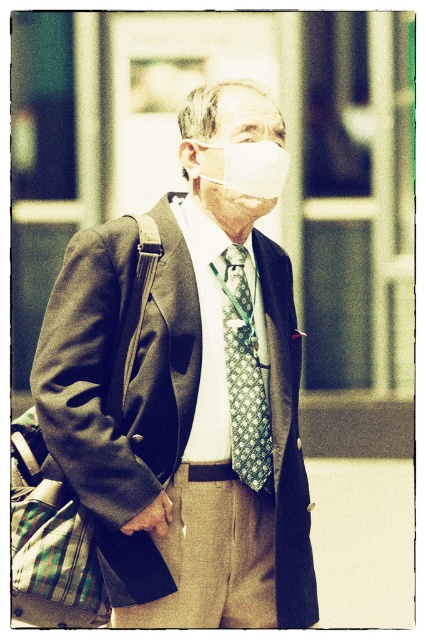
Based on the photo, who is lower down, matte black suit at center or white matte mask at center?

Positioned lower is matte black suit at center.

The image size is (426, 640). In order to click on matte black suit at center in this screenshot , I will do `click(187, 396)`.

This screenshot has height=640, width=426. What are the coordinates of `matte black suit at center` in the screenshot? It's located at (187, 396).

Is white matte mask at center shorter than green patterned tie at center?

Correct, white matte mask at center is not as tall as green patterned tie at center.

You are a GUI agent. You are given a task and a screenshot of the screen. Output one action in this format:
    pyautogui.click(x=<x>, y=<y>)
    Task: Click on the white matte mask at center
    
    Given the screenshot: What is the action you would take?
    pyautogui.click(x=241, y=156)

Where is `white matte mask at center`? The width and height of the screenshot is (426, 640). white matte mask at center is located at coordinates (241, 156).

Does matte black suit at center have a greater width compared to green patterned tie at center?

Correct, the width of matte black suit at center exceeds that of green patterned tie at center.

Which is above, matte black suit at center or green patterned tie at center?

Positioned higher is matte black suit at center.

This screenshot has height=640, width=426. Describe the element at coordinates (187, 396) in the screenshot. I see `matte black suit at center` at that location.

Where is `matte black suit at center`? The image size is (426, 640). matte black suit at center is located at coordinates (187, 396).